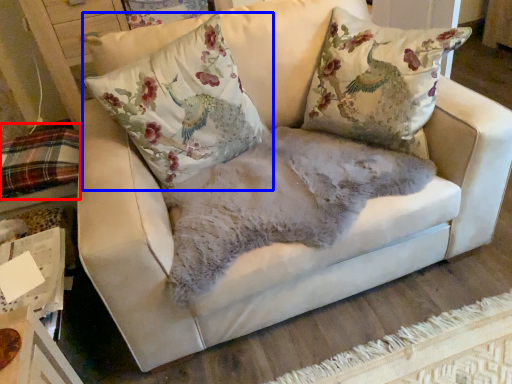
Question: Among these objects, which one is nearest to the camera, bedding (highlighted by a red box) or pillow (highlighted by a blue box)?

Choices:
 (A) bedding
 (B) pillow

Answer: (B)